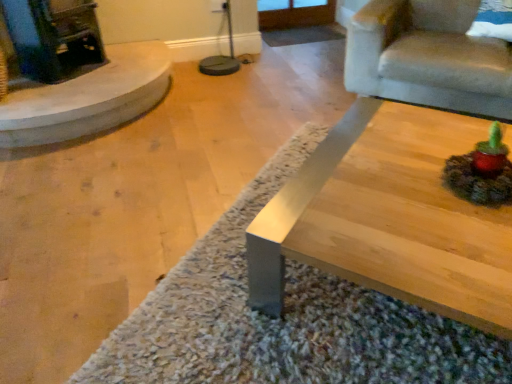
Image resolution: width=512 pixels, height=384 pixels. Describe the element at coordinates (284, 319) in the screenshot. I see `shaggy carpet at center` at that location.

What are the coordinates of `shaggy carpet at center` in the screenshot? It's located at (284, 319).

From a real-world perspective, is smooth beige fireplace at left beneath velvet beige armchair at upper right?

Indeed, from a real-world perspective, smooth beige fireplace at left is positioned beneath velvet beige armchair at upper right.

Which is in front, smooth beige fireplace at left or velvet beige armchair at upper right?

velvet beige armchair at upper right is closer to the camera.

Which object is closer to the camera, shaggy carpet at center or smooth beige fireplace at left?

shaggy carpet at center is closer to the camera.

Which of these two, shaggy carpet at center or smooth beige fireplace at left, is bigger?

With larger size is smooth beige fireplace at left.

From the image's perspective, does shaggy carpet at center appear higher than smooth beige fireplace at left?

No, from the image's perspective, shaggy carpet at center is not on top of smooth beige fireplace at left.

Between shaggy carpet at center and smooth beige fireplace at left, which one has more height?

Standing taller between the two is smooth beige fireplace at left.

Can you confirm if velvet beige armchair at upper right is bigger than smooth beige fireplace at left?

Yes, velvet beige armchair at upper right is bigger than smooth beige fireplace at left.

From the image's perspective, does velvet beige armchair at upper right appear higher than smooth beige fireplace at left?

Yes.

From a real-world perspective, is velvet beige armchair at upper right on top of smooth beige fireplace at left?

Yes, from a real-world perspective, velvet beige armchair at upper right is above smooth beige fireplace at left.

Is velvet beige armchair at upper right not near smooth beige fireplace at left?

That's right, there is a large distance between velvet beige armchair at upper right and smooth beige fireplace at left.

From the image's perspective, which one is positioned lower, shaggy carpet at center or velvet beige armchair at upper right?

shaggy carpet at center appears lower in the image.

What's the angular difference between shaggy carpet at center and velvet beige armchair at upper right's facing directions?

shaggy carpet at center and velvet beige armchair at upper right are facing 91.3 degrees away from each other.

Is point (221, 345) closer or farther from the camera than point (482, 55)?

Point (221, 345) is closer to the camera than point (482, 55).

Identify the location of mat on the left of velvet beige armchair at upper right. This screenshot has width=512, height=384. (284, 319).

Is velvet beige armchair at upper right taller or shorter than shaggy carpet at center?

Considering their sizes, velvet beige armchair at upper right has more height than shaggy carpet at center.

Is velvet beige armchair at upper right spatially inside shaggy carpet at center, or outside of it?

velvet beige armchair at upper right cannot be found inside shaggy carpet at center.

The image size is (512, 384). I want to click on mat that is below the velvet beige armchair at upper right (from the image's perspective), so click(x=284, y=319).

Based on their positions, is velvet beige armchair at upper right located to the left or right of shaggy carpet at center?

In the image, velvet beige armchair at upper right appears on the right side of shaggy carpet at center.

From the image's perspective, which is below, smooth beige fireplace at left or shaggy carpet at center?

shaggy carpet at center appears lower in the image.

At what (x,y) coordinates should I click in order to perform the action: click on mat on the right side of smooth beige fireplace at left. Please return your answer as a coordinate pair (x, y). This screenshot has height=384, width=512. Looking at the image, I should click on point(284,319).

Consider the image. Considering the sizes of smooth beige fireplace at left and shaggy carpet at center in the image, is smooth beige fireplace at left bigger or smaller than shaggy carpet at center?

Considering their sizes, smooth beige fireplace at left takes up more space than shaggy carpet at center.

Locate an element on the screen. The height and width of the screenshot is (384, 512). chair in front of the smooth beige fireplace at left is located at coordinates (428, 58).

You are a GUI agent. You are given a task and a screenshot of the screen. Output one action in this format:
    pyautogui.click(x=<x>, y=<y>)
    Task: Click on the fireplace lying on the left of shaggy carpet at center
    The width and height of the screenshot is (512, 384).
    Given the screenshot: What is the action you would take?
    pyautogui.click(x=74, y=74)

When comparing their distances from velvet beige armchair at upper right, does smooth beige fireplace at left or shaggy carpet at center seem closer?

The object closer to velvet beige armchair at upper right is shaggy carpet at center.

From the image, which object appears to be farther from shaggy carpet at center, smooth beige fireplace at left or velvet beige armchair at upper right?

Based on the image, smooth beige fireplace at left appears to be further to shaggy carpet at center.

Consider the image. Which object lies nearer to the anchor point smooth beige fireplace at left, shaggy carpet at center or velvet beige armchair at upper right?

shaggy carpet at center is positioned closer to the anchor smooth beige fireplace at left.

Considering their positions, is shaggy carpet at center positioned further to velvet beige armchair at upper right than smooth beige fireplace at left?

Among the two, smooth beige fireplace at left is located further to velvet beige armchair at upper right.

Looking at the image, which one is located closer to shaggy carpet at center, velvet beige armchair at upper right or smooth beige fireplace at left?

Based on the image, velvet beige armchair at upper right appears to be nearer to shaggy carpet at center.

From the image, which object appears to be farther from smooth beige fireplace at left, velvet beige armchair at upper right or shaggy carpet at center?

velvet beige armchair at upper right.

At what (x,y) coordinates should I click in order to perform the action: click on mat situated between smooth beige fireplace at left and velvet beige armchair at upper right from left to right. Please return your answer as a coordinate pair (x, y). Looking at the image, I should click on (284, 319).